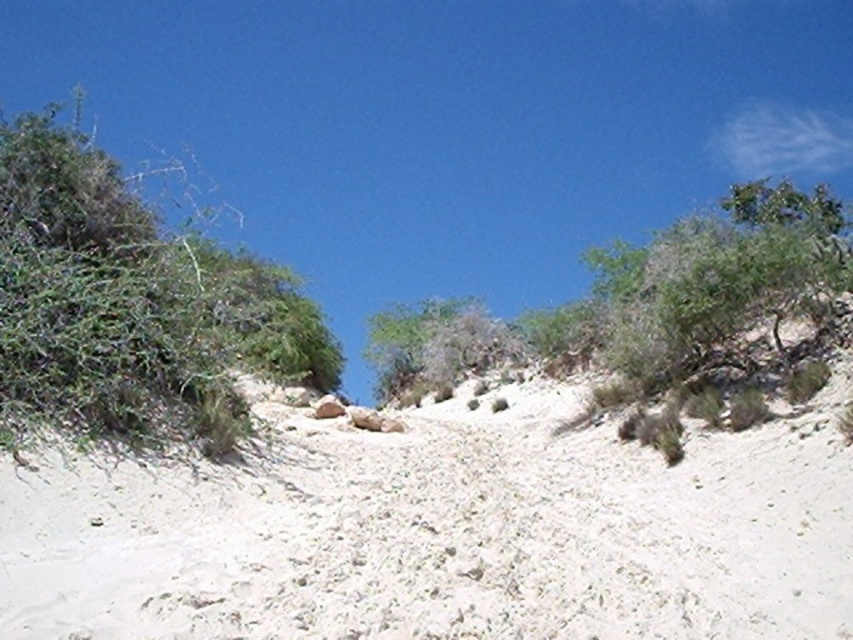
Which is more to the right, white sandy at center or green leafy bush at left?

From the viewer's perspective, white sandy at center appears more on the right side.

What do you see at coordinates (440, 531) in the screenshot? I see `white sandy at center` at bounding box center [440, 531].

You are a GUI agent. You are given a task and a screenshot of the screen. Output one action in this format:
    pyautogui.click(x=<x>, y=<y>)
    Task: Click on the white sandy at center
    
    Given the screenshot: What is the action you would take?
    click(440, 531)